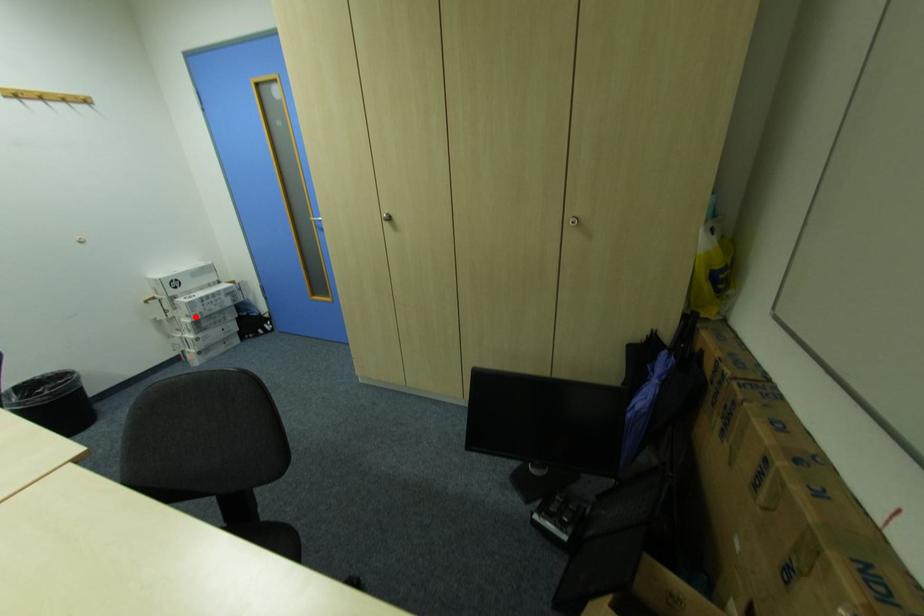
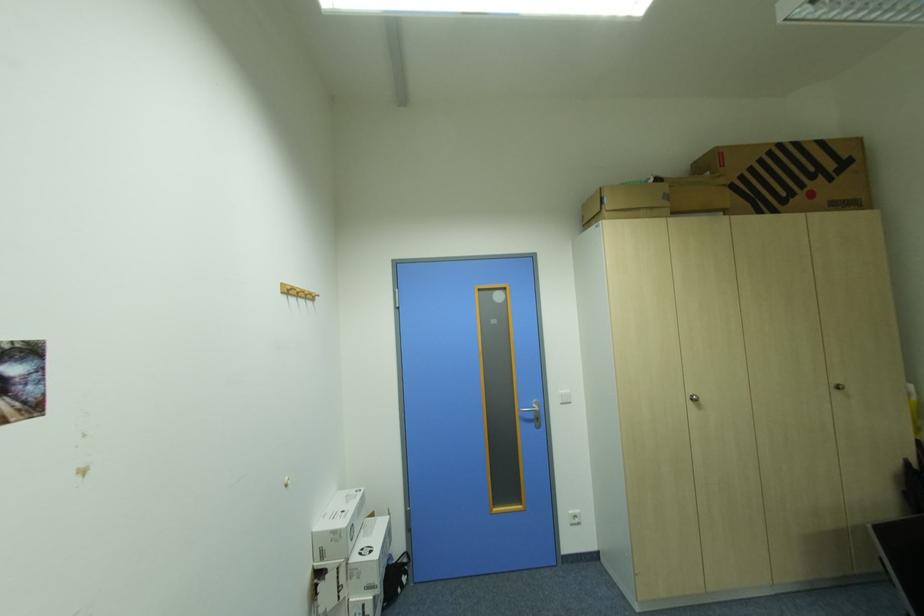
Where in the second image is the point corresponding to the highlighted location from the first image?

(377, 590)